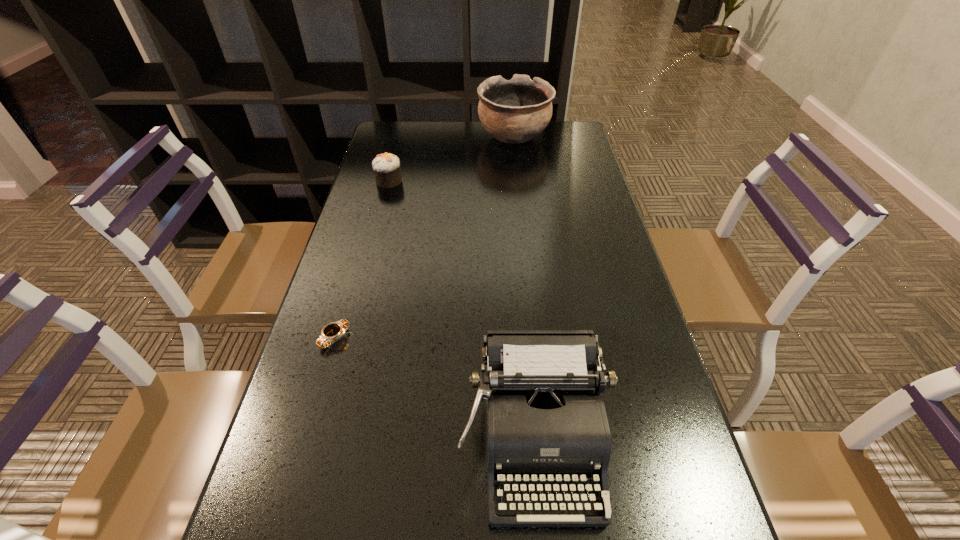
Locate an element on the screen. The height and width of the screenshot is (540, 960). vacant region located on the right of the shortest object is located at coordinates (472, 338).

The height and width of the screenshot is (540, 960). In order to click on object that is at the far edge in this screenshot , I will do click(514, 111).

At what (x,y) coordinates should I click in order to perform the action: click on cupcake that is at the left edge. Please return your answer as a coordinate pair (x, y). Looking at the image, I should click on (387, 168).

I want to click on watch positioned at the left edge, so click(x=331, y=332).

The image size is (960, 540). I want to click on pottery that is at the right edge, so click(514, 111).

Identify the location of typewriter that is at the right edge. (544, 421).

Image resolution: width=960 pixels, height=540 pixels. In order to click on object that is positioned at the far right corner in this screenshot , I will do `click(514, 111)`.

The image size is (960, 540). Identify the location of blank space at the far edge of the desktop. (475, 147).

This screenshot has height=540, width=960. Identify the location of free space at the left edge of the desktop. (391, 193).

What are the coordinates of `free spot at the right edge of the desktop` in the screenshot? It's located at (645, 321).